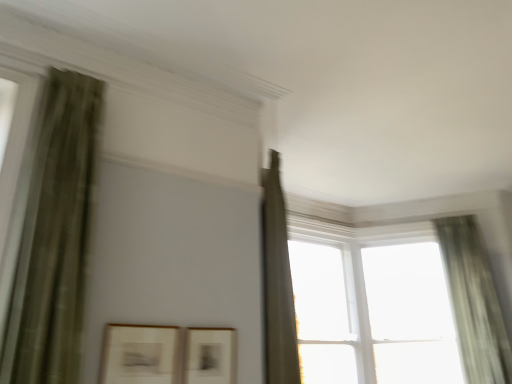
Question: Is green sheer curtain at right, which is the 1th curtain from right to left, far from transparent glass window at upper right, the 2th window in the right-to-left sequence?

Choices:
 (A) yes
 (B) no

Answer: (B)

Question: Considering the relative positions of green sheer curtain at right, which appears as the first curtain when viewed from the back, and transparent glass window at upper right, the 2th window in the right-to-left sequence, in the image provided, is green sheer curtain at right, which appears as the first curtain when viewed from the back, to the left of transparent glass window at upper right, the 2th window in the right-to-left sequence, from the viewer's perspective?

Choices:
 (A) yes
 (B) no

Answer: (B)

Question: Is green sheer curtain at right, which appears as the first curtain when viewed from the back, turned away from transparent glass window at upper right, the 2th window in the right-to-left sequence?

Choices:
 (A) no
 (B) yes

Answer: (A)

Question: Does green sheer curtain at right, the 2th curtain from the front, have a greater width compared to transparent glass window at upper right, the 2th window in the right-to-left sequence?

Choices:
 (A) no
 (B) yes

Answer: (B)

Question: Is green sheer curtain at right, which is the 1th curtain from right to left, smaller than transparent glass window at upper right, the 2th window in the right-to-left sequence?

Choices:
 (A) no
 (B) yes

Answer: (B)

Question: From the image's perspective, is transparent glass window at upper right, the 3th window in the left-to-right sequence, above or below green textured curtain at left, the 1th curtain positioned from the front?

Choices:
 (A) below
 (B) above

Answer: (A)

Question: From a real-world perspective, is transparent glass window at upper right, marked as the 1th window in a right-to-left arrangement, above or below green textured curtain at left, which is counted as the 2th curtain, starting from the back?

Choices:
 (A) above
 (B) below

Answer: (A)

Question: Considering the positions of point (453, 279) and point (52, 332), is point (453, 279) closer or farther from the camera than point (52, 332)?

Choices:
 (A) farther
 (B) closer

Answer: (A)

Question: Considering the positions of transparent glass window at upper right, marked as the 1th window in a right-to-left arrangement, and green textured curtain at left, which is the 2th curtain from right to left, in the image, is transparent glass window at upper right, marked as the 1th window in a right-to-left arrangement, bigger or smaller than green textured curtain at left, which is the 2th curtain from right to left,?

Choices:
 (A) small
 (B) big

Answer: (B)

Question: Choose the correct answer: Is green sheer curtain at right, the 2th curtain from the front, inside matte black picture frame at center, the 2th picture frame when ordered from left to right, or outside it?

Choices:
 (A) outside
 (B) inside

Answer: (A)

Question: Looking at the image, does green sheer curtain at right, the 2th curtain from the front, seem bigger or smaller compared to matte black picture frame at center, which ranks as the 1th picture frame in right-to-left order?

Choices:
 (A) big
 (B) small

Answer: (A)

Question: Considering their positions, is green sheer curtain at right, the 2th curtain from the front, located in front of or behind matte black picture frame at center, the 2th picture frame when ordered from left to right?

Choices:
 (A) front
 (B) behind

Answer: (B)

Question: In terms of height, does green sheer curtain at right, which is the 1th curtain from right to left, look taller or shorter compared to matte black picture frame at center, which ranks as the 1th picture frame in right-to-left order?

Choices:
 (A) tall
 (B) short

Answer: (A)

Question: Visually, is transparent glass window at upper right, the 2th window in the right-to-left sequence, positioned to the left or to the right of matte white picture frame at lower left, marked as the 1th picture frame in a left-to-right arrangement?

Choices:
 (A) right
 (B) left

Answer: (A)

Question: Relative to matte white picture frame at lower left, the 2th picture frame from the right, is transparent glass window at upper right, the 2th window in the right-to-left sequence, in front or behind?

Choices:
 (A) behind
 (B) front

Answer: (A)